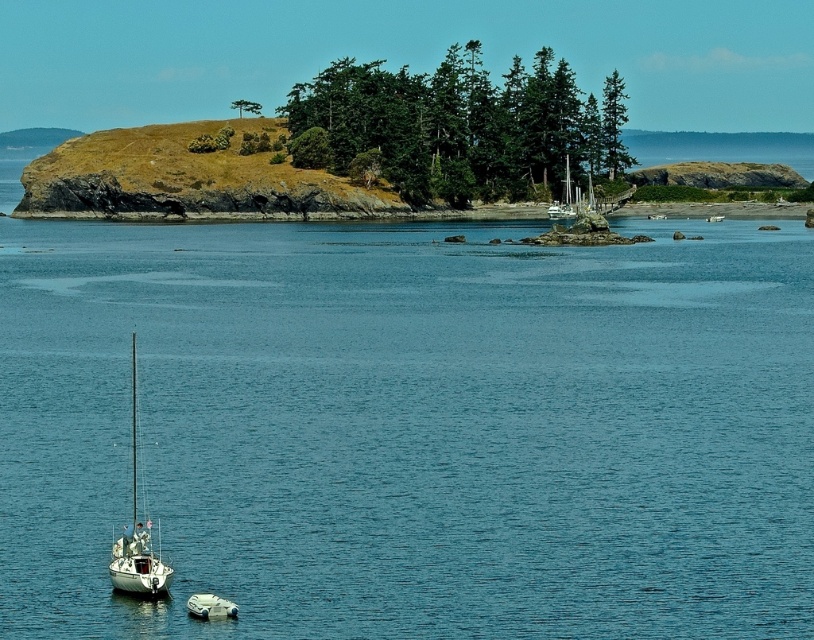
Question: Is brown grassy island at center further to the viewer compared to white matte sailboat at lower left?

Choices:
 (A) yes
 (B) no

Answer: (A)

Question: Can you confirm if clear blue water at center is thinner than white rubber dinghy at lower center?

Choices:
 (A) no
 (B) yes

Answer: (A)

Question: Which point is farther from the camera taking this photo?

Choices:
 (A) [230, 129]
 (B) [217, 611]
 (C) [130, 353]
 (D) [77, 276]

Answer: (A)

Question: Which of the following is the farthest from the observer?

Choices:
 (A) (335, 196)
 (B) (285, 259)
 (C) (143, 579)
 (D) (222, 605)

Answer: (A)

Question: Which object appears farthest from the camera in this image?

Choices:
 (A) clear blue water at center
 (B) white rubber dinghy at lower center
 (C) brown grassy island at center
 (D) white matte sailboat at lower left

Answer: (C)

Question: Does clear blue water at center appear on the right side of white matte sailboat at lower left?

Choices:
 (A) yes
 (B) no

Answer: (A)